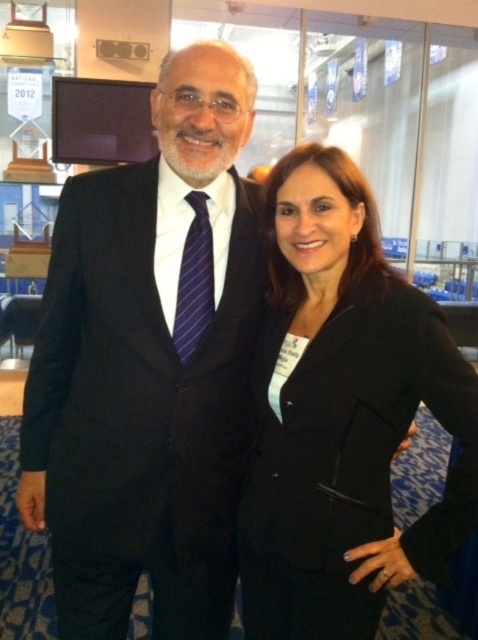
Based on the photo, who is more forward, (159, 269) or (347, 470)?

Point (347, 470) is more forward.

Between black matte suit at center and black matte blazer at center, which one has less height?

black matte blazer at center

Describe the element at coordinates (149, 365) in the screenshot. The image size is (478, 640). I see `black matte suit at center` at that location.

Find the location of a particular element. The height and width of the screenshot is (640, 478). black matte suit at center is located at coordinates (149, 365).

Can you confirm if black matte blazer at center is bigger than purple striped tie at center?

Yes, black matte blazer at center is bigger than purple striped tie at center.

Is black matte blazer at center shorter than purple striped tie at center?

Incorrect, black matte blazer at center's height does not fall short of purple striped tie at center's.

This screenshot has width=478, height=640. Find the location of `black matte blazer at center`. black matte blazer at center is located at coordinates (343, 413).

Can you confirm if black matte suit at center is positioned to the right of purple striped tie at center?

Incorrect, black matte suit at center is not on the right side of purple striped tie at center.

Between black matte suit at center and purple striped tie at center, which one has less height?

With less height is purple striped tie at center.

Between point (119, 637) and point (196, 330), which one is positioned behind?

Point (119, 637)

This screenshot has height=640, width=478. I want to click on black matte suit at center, so click(x=149, y=365).